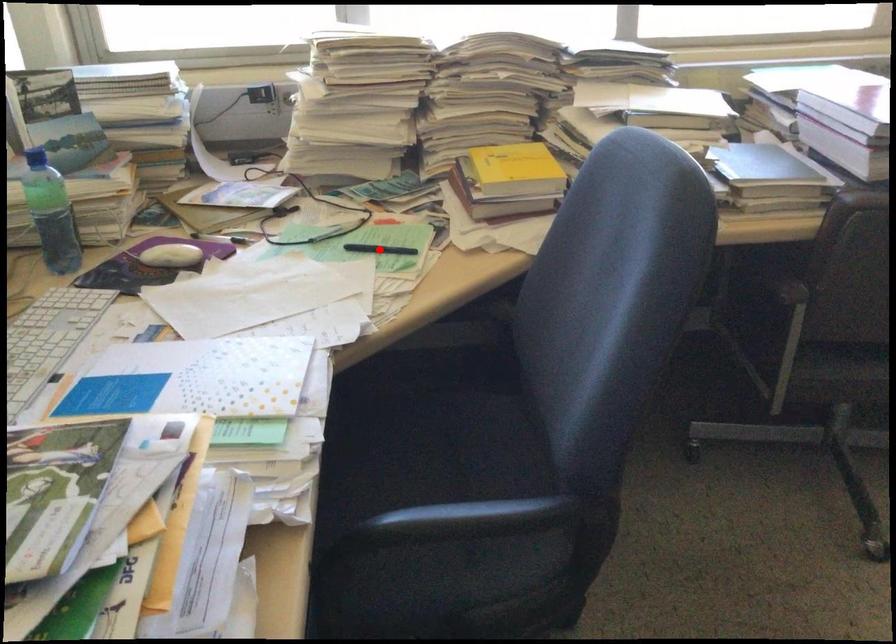
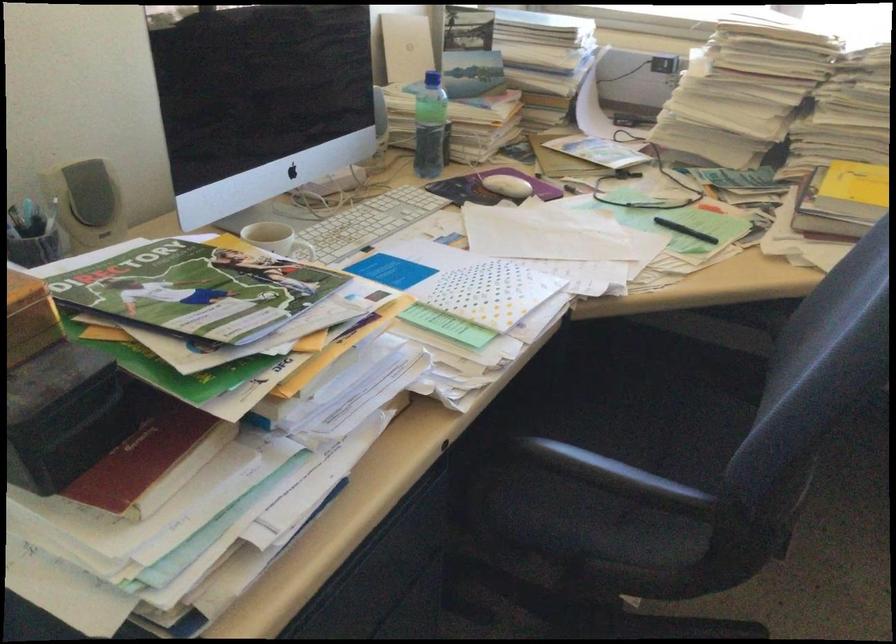
The point at the highlighted location is marked in the first image. Where is the corresponding point in the second image?

(684, 230)